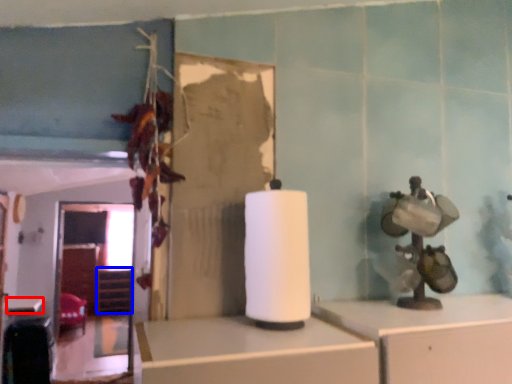
Question: Which point is further to the camera, table (highlighted by a red box) or shelf (highlighted by a blue box)?

Choices:
 (A) table
 (B) shelf

Answer: (B)